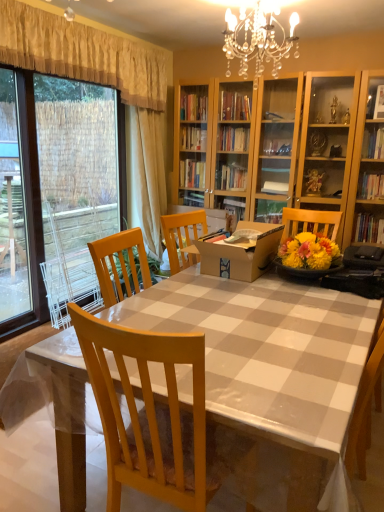
Question: Does white glossy table at center have a larger size compared to transparent glass door at left?

Choices:
 (A) no
 (B) yes

Answer: (B)

Question: From the image's perspective, is white glossy table at center located beneath transparent glass door at left?

Choices:
 (A) no
 (B) yes

Answer: (B)

Question: Does white glossy table at center lie behind transparent glass door at left?

Choices:
 (A) no
 (B) yes

Answer: (A)

Question: From the image's perspective, does white glossy table at center appear higher than transparent glass door at left?

Choices:
 (A) no
 (B) yes

Answer: (A)

Question: From a real-world perspective, is white glossy table at center located beneath transparent glass door at left?

Choices:
 (A) no
 (B) yes

Answer: (B)

Question: From a real-world perspective, is white glossy table at center physically above transparent glass door at left?

Choices:
 (A) no
 (B) yes

Answer: (A)

Question: Is yellow textured curtain at upper left, marked as the first curtain in a front-to-back arrangement, not close to beige fabric curtain at upper left, which appears as the 1th curtain when viewed from the back?

Choices:
 (A) no
 (B) yes

Answer: (A)

Question: Is yellow textured curtain at upper left, marked as the second curtain in a back-to-front arrangement, turned away from beige fabric curtain at upper left, which appears as the 1th curtain when viewed from the back?

Choices:
 (A) no
 (B) yes

Answer: (A)

Question: From a real-world perspective, is yellow textured curtain at upper left, marked as the second curtain in a back-to-front arrangement, positioned under beige fabric curtain at upper left, which ranks as the 2th curtain in front-to-back order, based on gravity?

Choices:
 (A) no
 (B) yes

Answer: (A)

Question: Is yellow textured curtain at upper left, marked as the first curtain in a front-to-back arrangement, not within beige fabric curtain at upper left, which appears as the 1th curtain when viewed from the back?

Choices:
 (A) yes
 (B) no

Answer: (A)

Question: Can beige fabric curtain at upper left, which appears as the 1th curtain when viewed from the back, be found inside yellow textured curtain at upper left, marked as the second curtain in a back-to-front arrangement?

Choices:
 (A) yes
 (B) no

Answer: (B)

Question: Can you confirm if yellow textured curtain at upper left, marked as the second curtain in a back-to-front arrangement, is positioned to the right of beige fabric curtain at upper left, which appears as the 1th curtain when viewed from the back?

Choices:
 (A) no
 (B) yes

Answer: (A)

Question: Could yellow textured curtain at upper left, marked as the second curtain in a back-to-front arrangement, be considered to be inside transparent glass door at left?

Choices:
 (A) no
 (B) yes

Answer: (A)